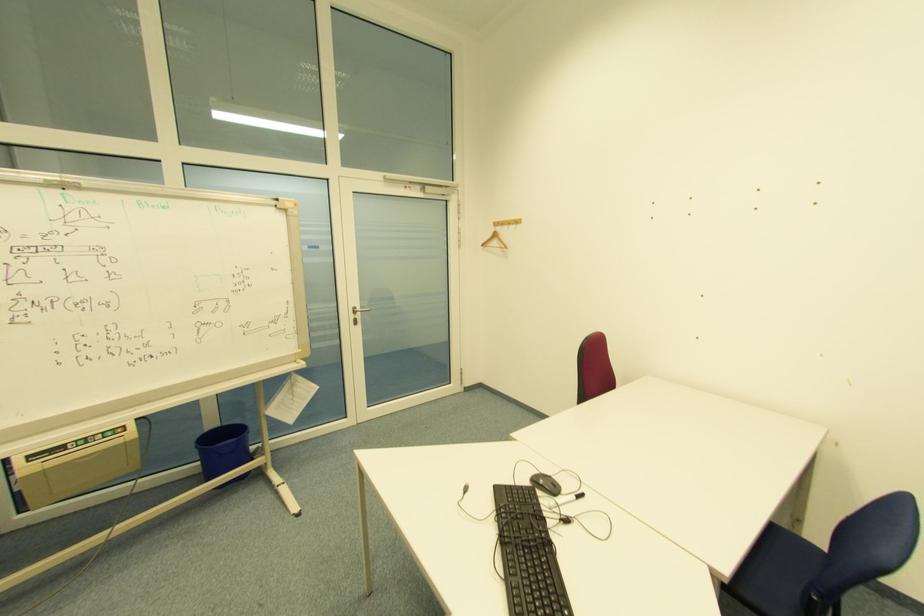
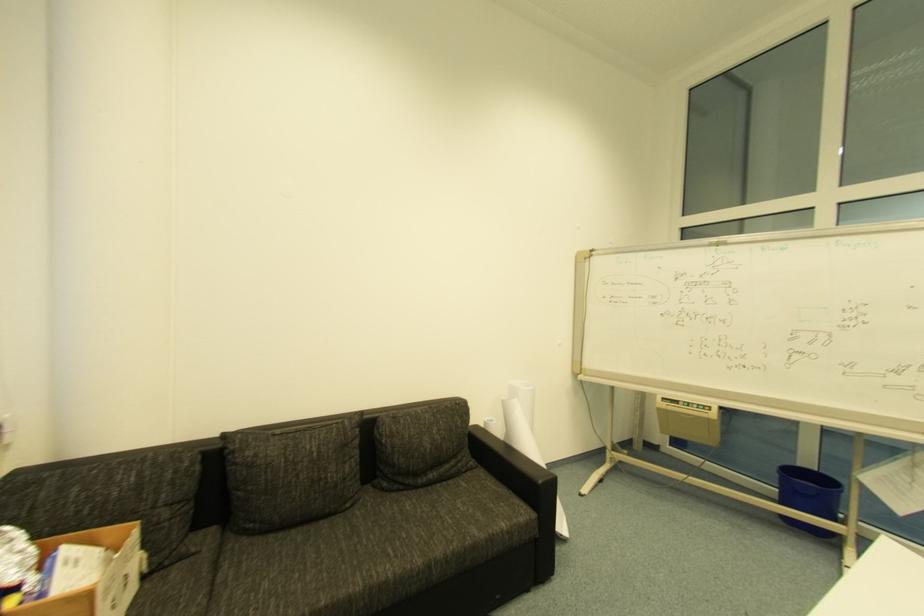
Question: The camera is either moving clockwise (left) or counter-clockwise (right) around the object. The first image is from the beginning of the video and the second image is from the end. Is the camera moving left or right when shooting the video?

Choices:
 (A) Left
 (B) Right

Answer: (B)